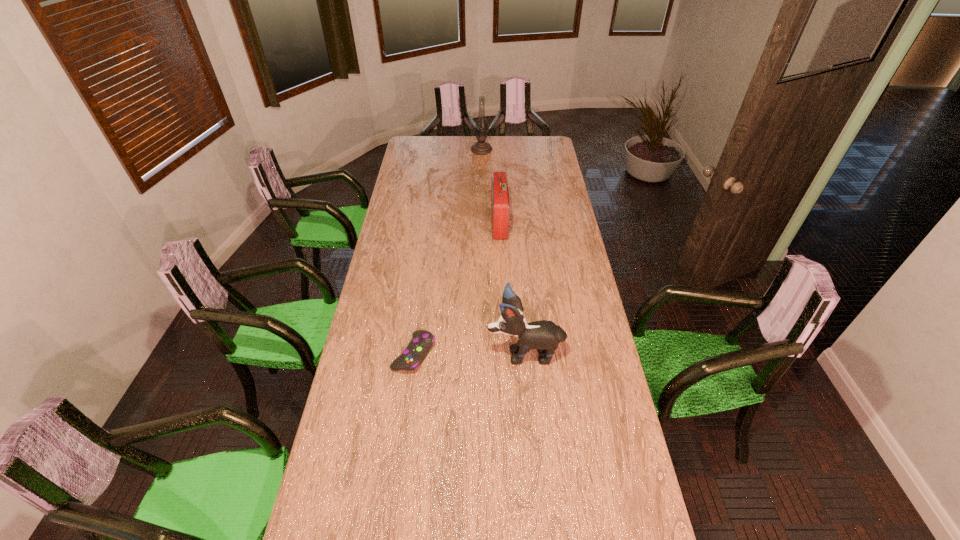
You are a GUI agent. You are given a task and a screenshot of the screen. Output one action in this format:
    pyautogui.click(x=<x>, y=<y>)
    Task: Click on the farthest object
    This screenshot has height=540, width=960.
    Given the screenshot: What is the action you would take?
    pyautogui.click(x=481, y=147)

You are a GUI agent. You are given a task and a screenshot of the screen. Output one action in this format:
    pyautogui.click(x=<x>, y=<y>)
    Task: Click on the puppy
    The height and width of the screenshot is (540, 960).
    Given the screenshot: What is the action you would take?
    pyautogui.click(x=543, y=335)

You are a GUI agent. You are given a task and a screenshot of the screen. Output one action in this format:
    pyautogui.click(x=<x>, y=<y>)
    Task: Click on the first-aid kit
    The image size is (960, 540).
    Given the screenshot: What is the action you would take?
    pyautogui.click(x=500, y=205)

In order to click on the second farthest object in this screenshot , I will do `click(500, 205)`.

In order to click on control in this screenshot , I will do `click(418, 348)`.

Where is `the leftmost object`? This screenshot has height=540, width=960. the leftmost object is located at coordinates (418, 348).

You are a GUI agent. You are given a task and a screenshot of the screen. Output one action in this format:
    pyautogui.click(x=<x>, y=<y>)
    Task: Click on the vacant space located 0.080m on the front of the oil lamp
    
    Given the screenshot: What is the action you would take?
    (482, 163)

I want to click on vacant space located on the front-facing side of the puppy, so click(432, 353).

Locate an element on the screen. vacant space located on the front-facing side of the puppy is located at coordinates (402, 353).

Identify the location of vacant space located on the front-facing side of the puppy. The image size is (960, 540). (451, 353).